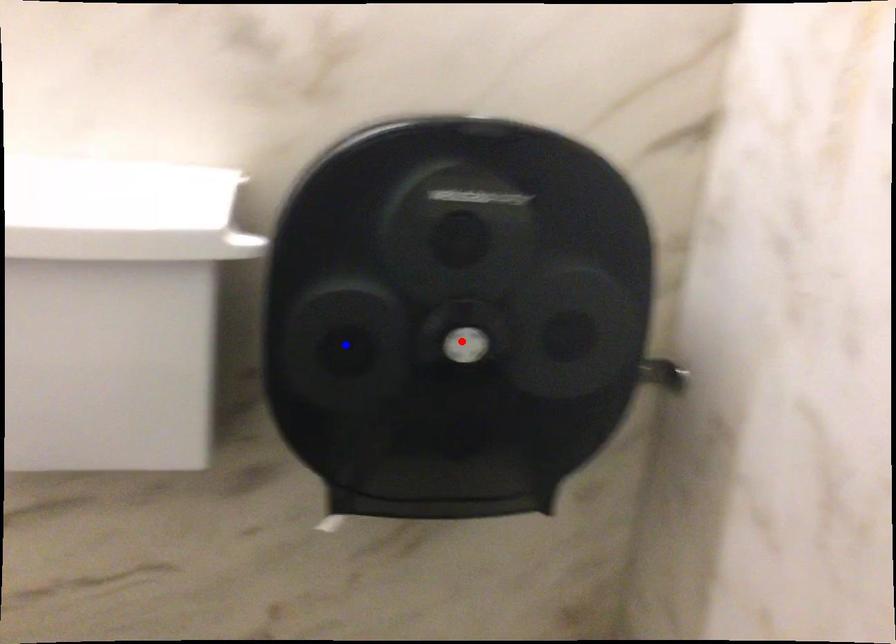
Question: In the image, two points are highlighted. Which point is nearer to the camera? Reply with the corresponding letter.

Choices:
 (A) blue point
 (B) red point

Answer: (A)